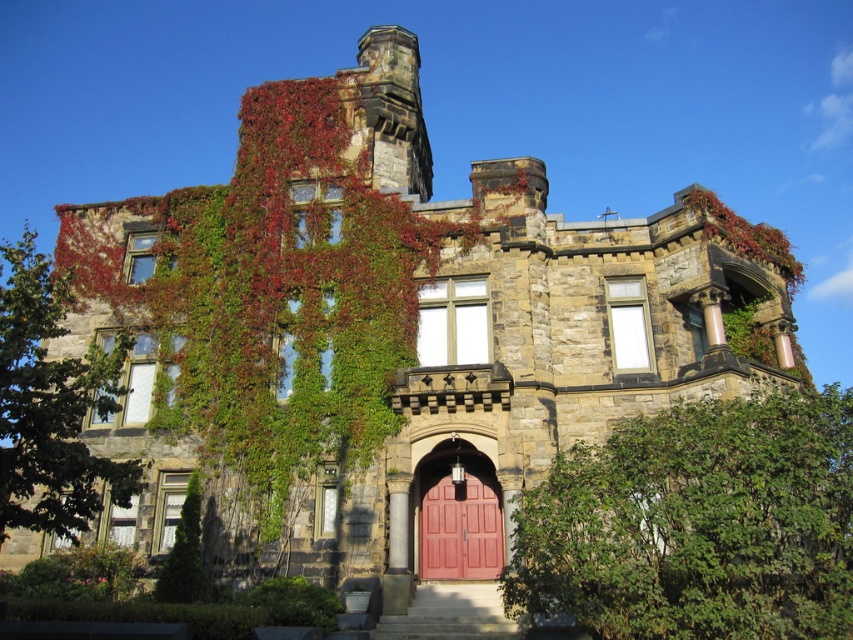
You are standing 50 meters away from the grand stone building. You want to move closer to the point marked at coordinates point (x=648, y=417). Will you be able to reach it without moving past the building itself?

The distance of point (x=648, y=417) from viewer is 47.14 meters, so yes, you can reach it without moving past the building since you are currently 50 meters away and the point is only 47.14 meters away from you.

You are a painter standing at the base of the grand stone building. You need to decide which object, the green leafy ivy at right or the matte wood door at center, you should paint first if you want to start with the taller one. Which one should you choose?

The green leafy ivy at right has a greater height compared to the matte wood door at center, so you should paint the green leafy ivy at right first.

You are standing in front of the grand stone building and want to determine the relative positions of two specific points marked on the structure. The first point is located at coordinates point (769, 429), and the second point is at point (466, 540). Which of these two points appears closer to you when viewed from your current position?

Point (769, 429) is closer to the viewer than point (466, 540), so the first point appears closer when viewed from your current position.